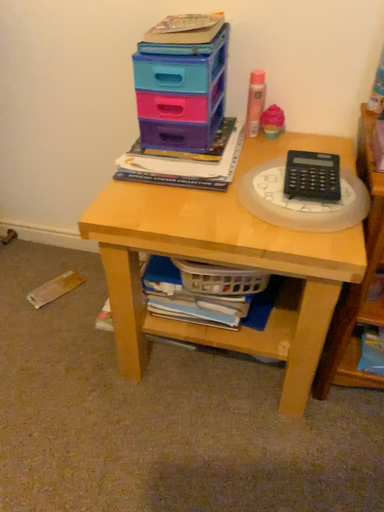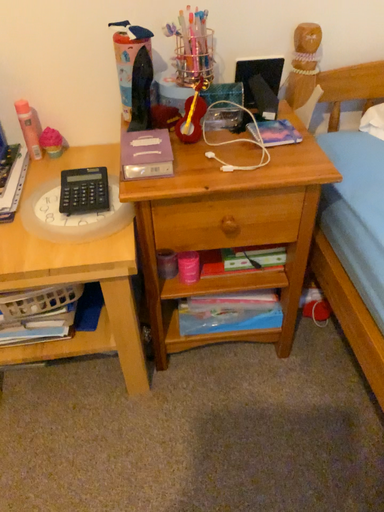
Question: How did the camera likely rotate when shooting the video?

Choices:
 (A) rotated left
 (B) rotated right

Answer: (B)